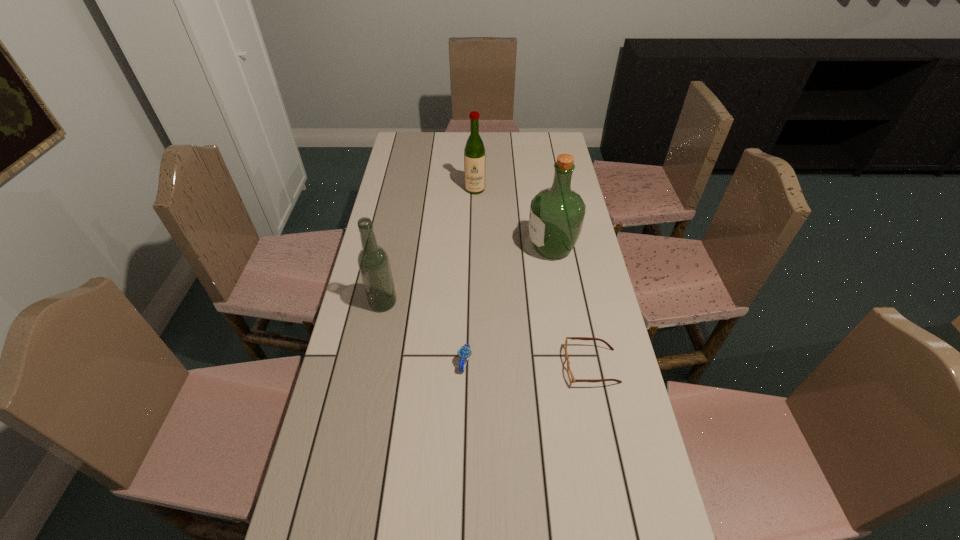
The image size is (960, 540). I want to click on free point between the watch and the spectacles, so click(x=528, y=364).

The image size is (960, 540). Find the location of `free space between the spectacles and the nearest liquor`. free space between the spectacles and the nearest liquor is located at coordinates (487, 334).

Where is `vacant space that is in between the leftmost object and the second farthest liquor`? The height and width of the screenshot is (540, 960). vacant space that is in between the leftmost object and the second farthest liquor is located at coordinates (468, 275).

You are a GUI agent. You are given a task and a screenshot of the screen. Output one action in this format:
    pyautogui.click(x=<x>, y=<y>)
    Task: Click on the vacant area between the leftmost liquor and the rightmost liquor
    
    Given the screenshot: What is the action you would take?
    pyautogui.click(x=468, y=275)

This screenshot has width=960, height=540. Identify the location of the second closest object to the watch. (570, 374).

Locate an element on the screen. the third closest object to the watch is located at coordinates point(556,217).

Find the location of a particular element. The width and height of the screenshot is (960, 540). liquor that is the second closest one to the second nearest liquor is located at coordinates (373, 261).

Select which liquor appears as the closest to the second nearest liquor. Please provide its 2D coordinates. Your answer should be formatted as a tuple, i.e. [(x, y)], where the tuple contains the x and y coordinates of a point satisfying the conditions above.

[(474, 153)]

At what (x,y) coordinates should I click in order to perform the action: click on vacant point that satisfies the following two spatial constraints: 1. on the front side of the watch; 2. on the right side of the nearest liquor. Please return your answer as a coordinate pair (x, y). The image size is (960, 540). Looking at the image, I should click on (372, 362).

Locate an element on the screen. The width and height of the screenshot is (960, 540). free spot that satisfies the following two spatial constraints: 1. on the front side of the watch; 2. on the right side of the leftmost liquor is located at coordinates (372, 362).